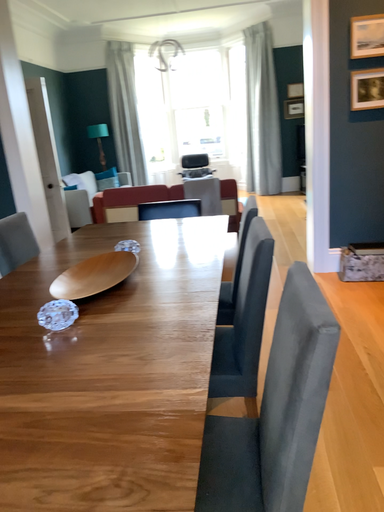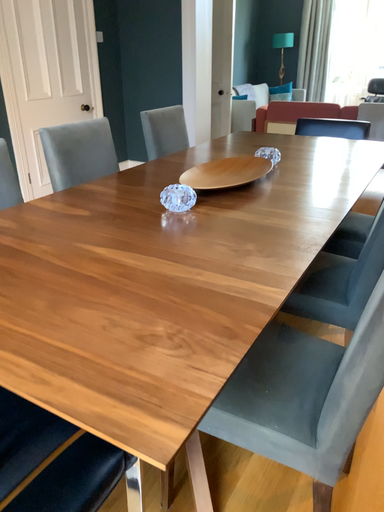
Question: Which way did the camera rotate in the video?

Choices:
 (A) rotated left
 (B) rotated right

Answer: (A)